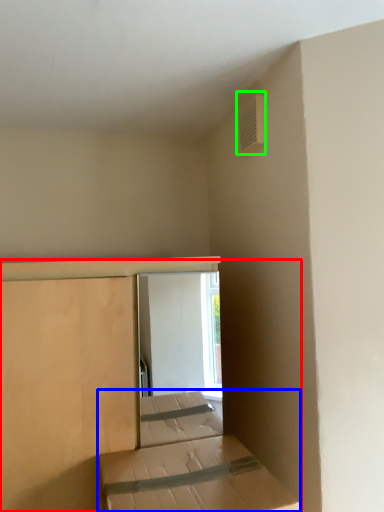
Question: Which object is the farthest from bed (highlighted by a red box)? Choose among these: bed (highlighted by a blue box) or air conditioning (highlighted by a green box).

Choices:
 (A) bed
 (B) air conditioning

Answer: (B)